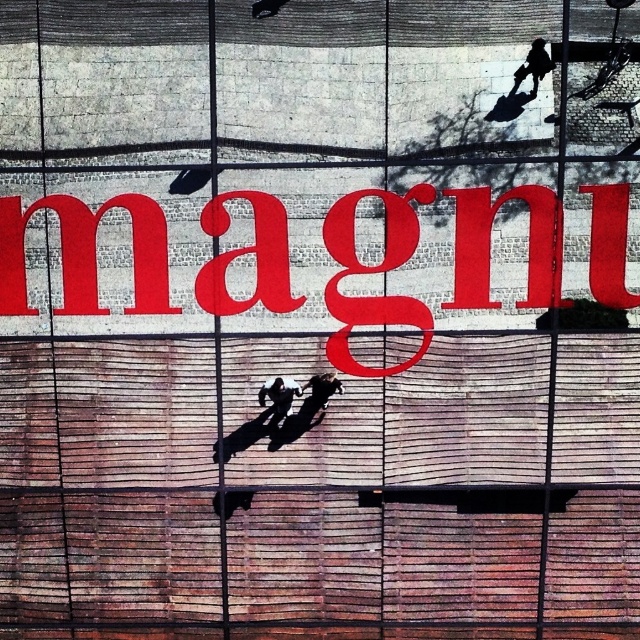
Can you confirm if red matte sign at center is positioned above smooth black suit at upper right?

Actually, red matte sign at center is below smooth black suit at upper right.

Between red matte sign at center and smooth black suit at upper right, which one is positioned higher?

smooth black suit at upper right is above.

Is point (144, 240) farther from camera compared to point (516, 77)?

That is True.

At what (x,y) coordinates should I click in order to perform the action: click on red matte sign at center. Please return your answer as a coordinate pair (x, y). Looking at the image, I should click on coord(84,253).

Is point (540, 67) more distant than point (504, 109)?

No, (540, 67) is closer to viewer.

Who is positioned more to the right, smooth black suit at upper right or shiny black skateboard at upper right?

smooth black suit at upper right is more to the right.

The width and height of the screenshot is (640, 640). What do you see at coordinates (532, 67) in the screenshot? I see `smooth black suit at upper right` at bounding box center [532, 67].

Identify the location of smooth black suit at upper right. This screenshot has width=640, height=640. (532, 67).

Between point (19, 296) and point (266, 390), which one is positioned in front?

Point (266, 390) is more forward.

Is red matte sign at center to the left of black matte skateboard at center from the viewer's perspective?

In fact, red matte sign at center is to the right of black matte skateboard at center.

Which is in front, point (164, 280) or point (288, 406)?

Point (288, 406) is more forward.

The image size is (640, 640). In order to click on red matte sign at center in this screenshot , I will do `click(84, 253)`.